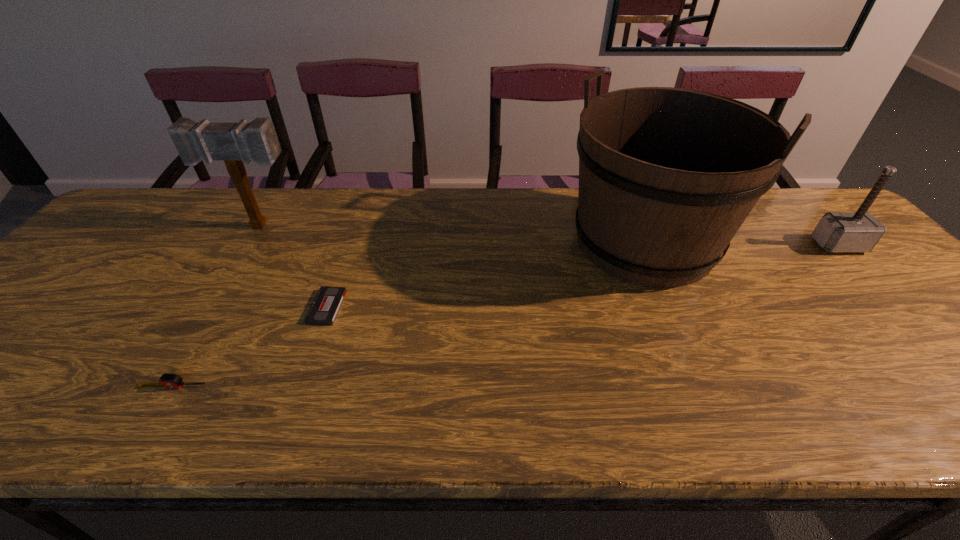
Locate an element on the screen. the tallest object is located at coordinates (667, 176).

What are the coordinates of `the second object from right to left` in the screenshot? It's located at tap(667, 176).

Where is `mallet`? Image resolution: width=960 pixels, height=540 pixels. mallet is located at coordinates (232, 142).

This screenshot has height=540, width=960. I want to click on the third tallest object, so click(860, 231).

The image size is (960, 540). What are the coordinates of `hammer` in the screenshot? It's located at pyautogui.click(x=860, y=231).

The image size is (960, 540). What are the coordinates of `the second shortest object` in the screenshot? It's located at (168, 381).

Where is `the nearest object`? The height and width of the screenshot is (540, 960). the nearest object is located at coordinates click(x=168, y=381).

I want to click on videotape, so click(x=328, y=300).

Where is `the third object from right to left`? the third object from right to left is located at coordinates (328, 300).

This screenshot has height=540, width=960. I want to click on vacant space located 0.380m on the left of the bucket, so click(426, 242).